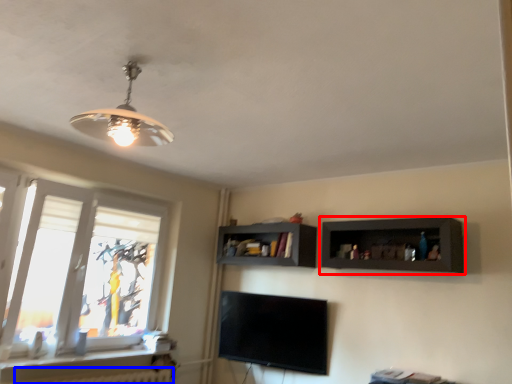
Question: Which of the following is the closest to the observer, shelf (highlighted by a red box) or radiator (highlighted by a blue box)?

Choices:
 (A) shelf
 (B) radiator

Answer: (B)